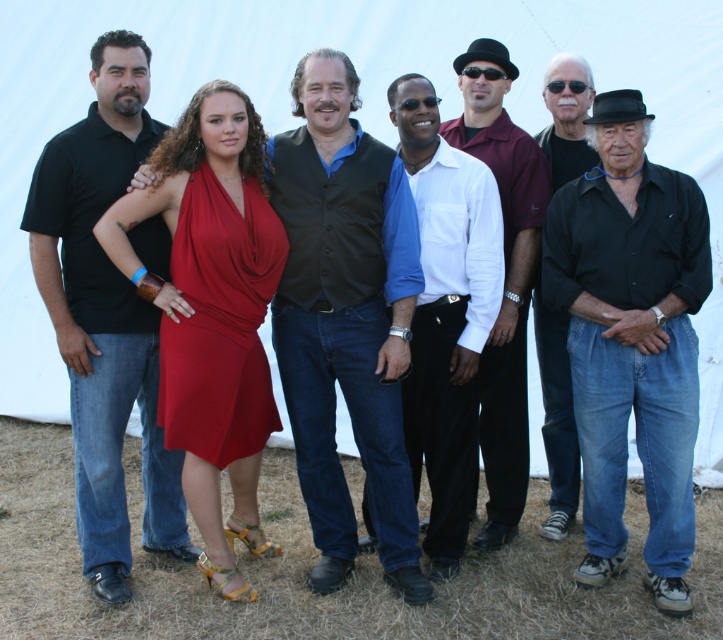
Question: Which point is closer to the camera?

Choices:
 (A) pyautogui.click(x=568, y=161)
 (B) pyautogui.click(x=500, y=99)

Answer: (A)

Question: Can you confirm if matte red dress at center is positioned to the left of black leather hat at center?

Choices:
 (A) no
 (B) yes

Answer: (B)

Question: Based on their relative distances, which object is farther from the black matte shirt at right?

Choices:
 (A) black matte shirt at center
 (B) matte red dress at center

Answer: (B)

Question: Which point is closer to the camera?

Choices:
 (A) (260, 422)
 (B) (435, 115)
 (C) (555, 156)

Answer: (A)

Question: Does black matte shirt at center come in front of matte black shirt at left?

Choices:
 (A) yes
 (B) no

Answer: (A)

Question: From the image, what is the correct spatial relationship of blue shirt at center in relation to black matte shirt at right?

Choices:
 (A) below
 (B) above

Answer: (B)